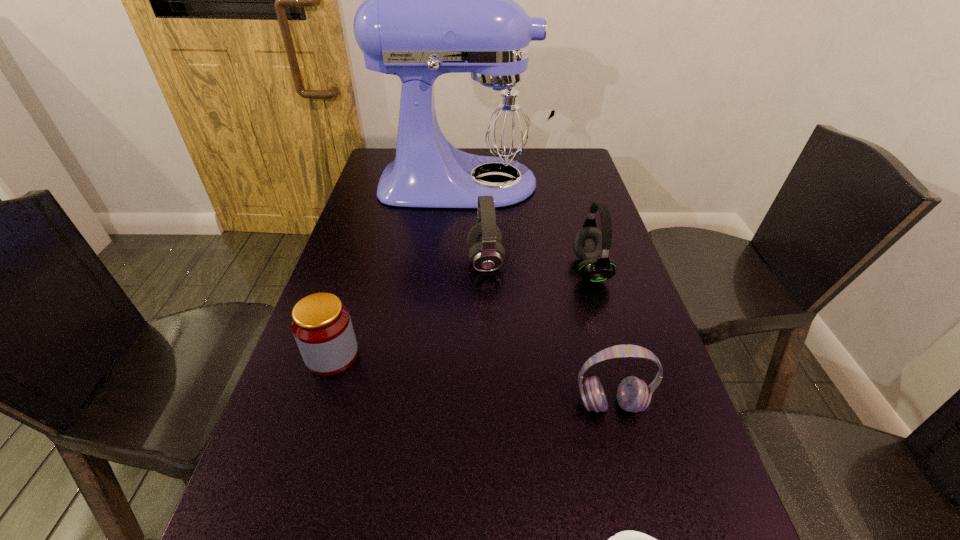
Identify the location of vacant area at the far left corner. Image resolution: width=960 pixels, height=540 pixels. (383, 153).

The image size is (960, 540). In the image, there is a desktop. In order to click on vacant region at the far right corner in this screenshot , I will do `click(588, 167)`.

Locate an element on the screen. The height and width of the screenshot is (540, 960). free space between the leftmost headset and the mixer is located at coordinates (475, 222).

Where is `free space between the third nearest object and the nearest headset`? The width and height of the screenshot is (960, 540). free space between the third nearest object and the nearest headset is located at coordinates (471, 380).

Where is `vacant space in between the nearest headset and the farthest object`? Image resolution: width=960 pixels, height=540 pixels. vacant space in between the nearest headset and the farthest object is located at coordinates (538, 294).

Where is `unoccupied area between the leftmost headset and the jar`? The height and width of the screenshot is (540, 960). unoccupied area between the leftmost headset and the jar is located at coordinates (409, 308).

Image resolution: width=960 pixels, height=540 pixels. What are the coordinates of `vacant region between the second nearest object and the fourth farthest object` in the screenshot? It's located at (471, 380).

In order to click on free point between the leftmost headset and the farthest object in this screenshot , I will do `click(475, 222)`.

Identify which object is the third closest to the fourth farthest object. Please provide its 2D coordinates. Your answer should be formatted as a tuple, i.e. [(x, y)], where the tuple contains the x and y coordinates of a point satisfying the conditions above.

[(438, 0)]

Choose which object is the fifth nearest neighbor to the bowl. Please provide its 2D coordinates. Your answer should be formatted as a tuple, i.e. [(x, y)], where the tuple contains the x and y coordinates of a point satisfying the conditions above.

[(438, 0)]